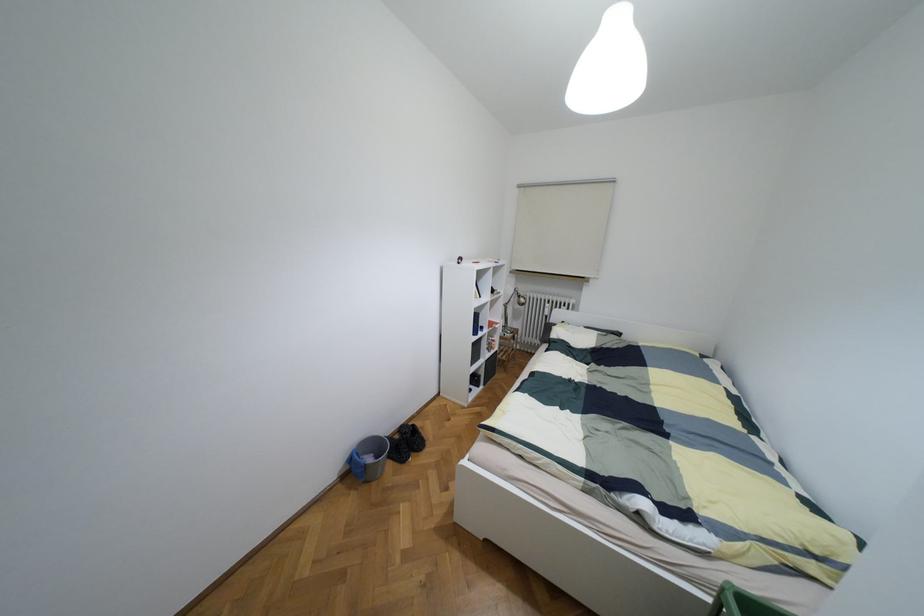
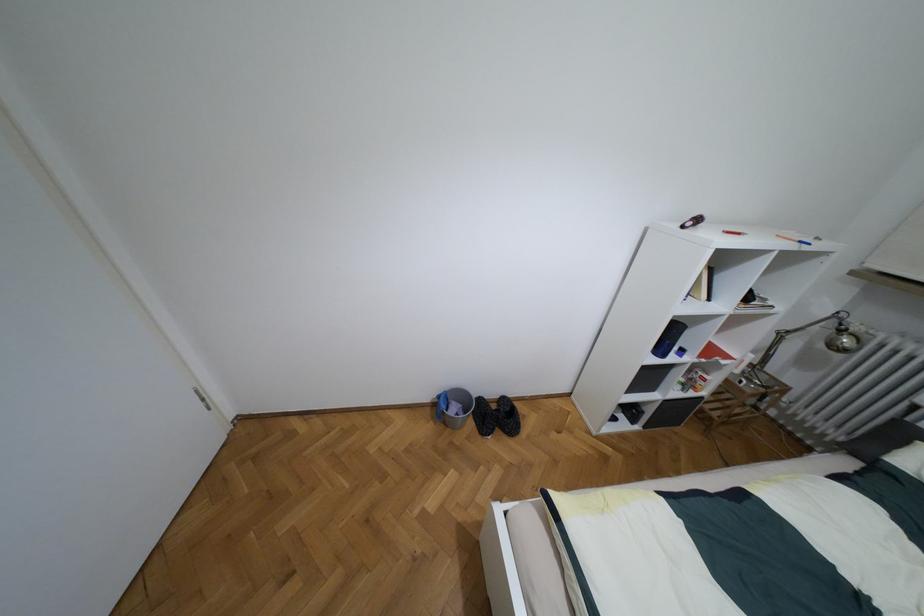
Where in the second image is the point corresponding to point (505, 305) from the first image?

(781, 334)